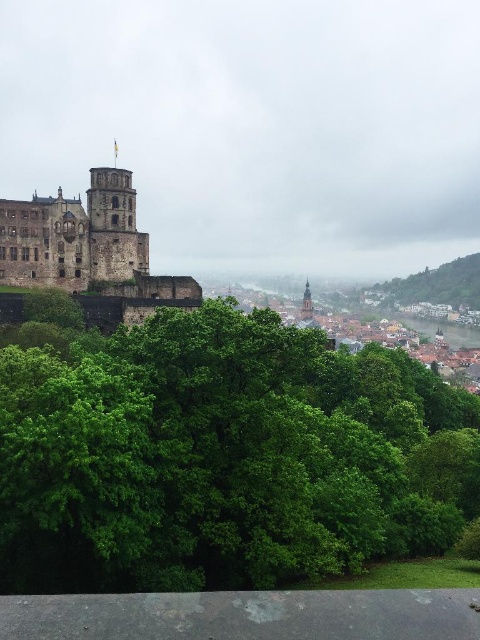
You are standing at the base of Heidelberg Castle and want to take a photo. There are two points of interest marked in the scene. The first point is at coordinates point (135, 560) and the second is at point (308, 296). Which point is closer to you when you are facing the castle?

Point (135, 560) is closer to the viewer than point (308, 296).

You are standing at the entrance of the brown stone castle at left and want to walk towards the green leafy tree at lower right. Which direction should you head to reach the tree?

The brown stone castle at left is positioned under the green leafy tree at lower right, so you should head towards the right and forward to reach the tree.